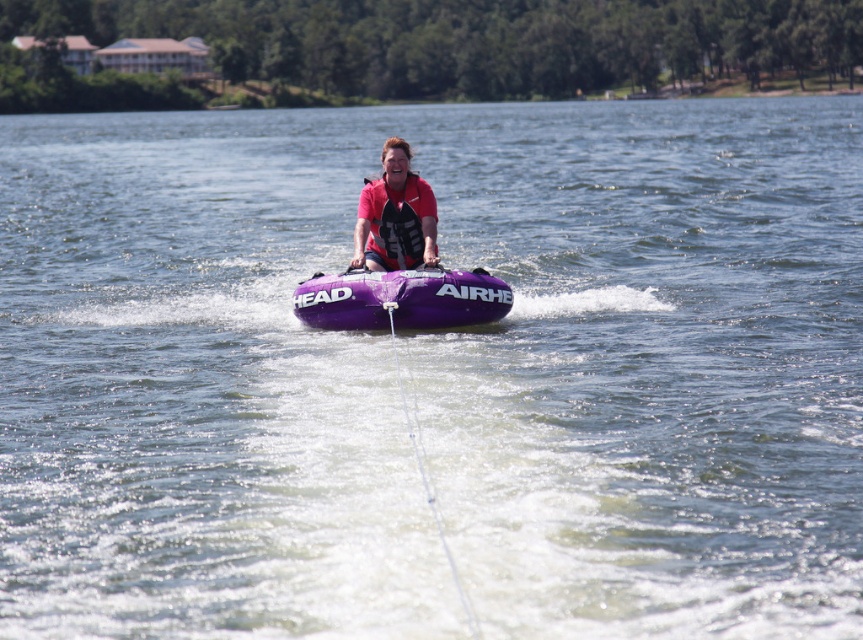
You are a safety inspector checking the water tubing equipment. You notice the purple inflatable tube at center and the matte red life vest at center. According to safety regulations, the life vest must be at least as wide as the tube to ensure proper buoyancy. Is the current setup compliant?

The purple inflatable tube at center has a larger width than the matte red life vest at center, so the life vest is narrower than required. This setup does not comply with safety regulations because the life vest must be at least as wide as the tube for proper buoyancy.

You are a safety inspector checking the water tubing equipment. You notice the purple inflatable tube at center and the matte red life vest at center. Which equipment is bigger in size?

The purple inflatable tube at center is larger in size than the matte red life vest at center.

You are a safety inspector checking the water tubing setup. The purple inflatable tube at center and the matte red life vest at center are both essential for safety. According to safety regulations, the life vest must be positioned above the tube to ensure easy access. Is the current arrangement compliant with safety standards?

The purple inflatable tube at center is below the matte red life vest at center, so the current arrangement is compliant with safety standards because the life vest is positioned above the tube as required.